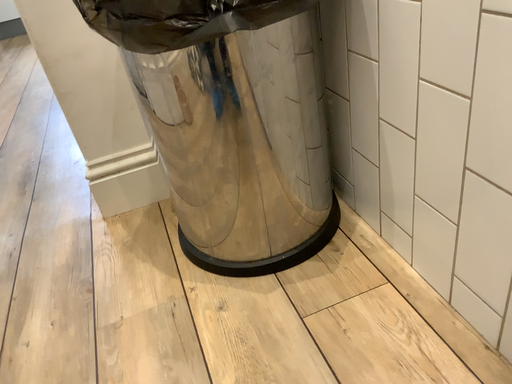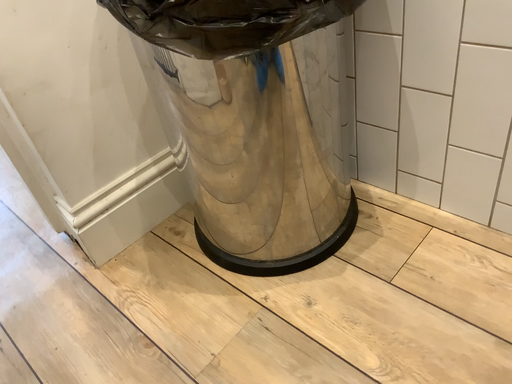
Question: Which way did the camera rotate in the video?

Choices:
 (A) rotated right
 (B) rotated left

Answer: (A)